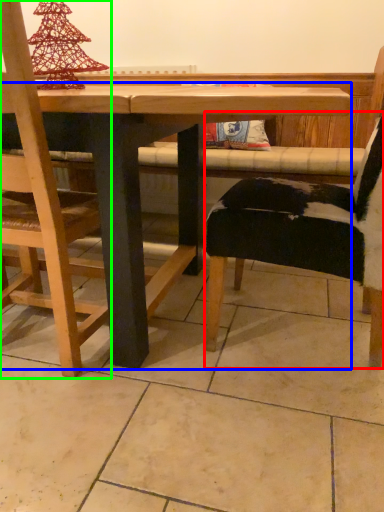
Question: Based on their relative distances, which object is farther from chair (highlighted by a red box)? Choose from table (highlighted by a blue box) and chair (highlighted by a green box).

Choices:
 (A) table
 (B) chair

Answer: (B)